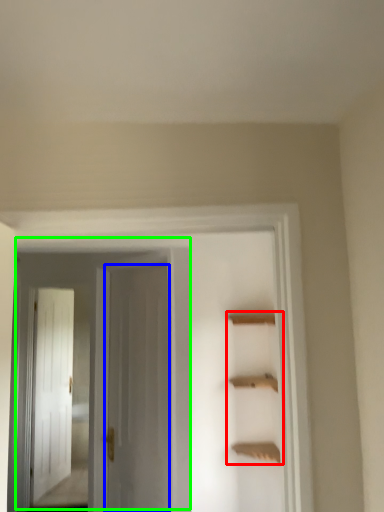
Question: Estimate the real-world distances between objects in this image. Which object is farther from cabinet (highlighted by a red box), door (highlighted by a blue box) or door (highlighted by a green box)?

Choices:
 (A) door
 (B) door

Answer: (A)